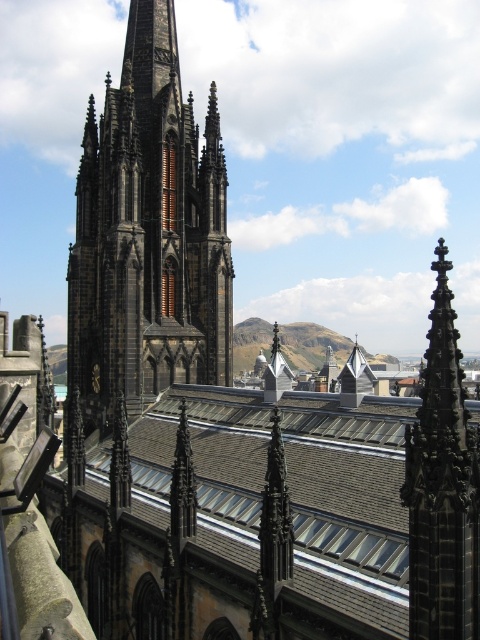
Between brown tile roof at center and dark gray stone tower at center, which one is positioned higher?

dark gray stone tower at center is above.

Is point (312, 584) positioned in front of point (88, 257)?

Yes.

The height and width of the screenshot is (640, 480). What are the coordinates of `brown tile roof at center` in the screenshot? It's located at (250, 516).